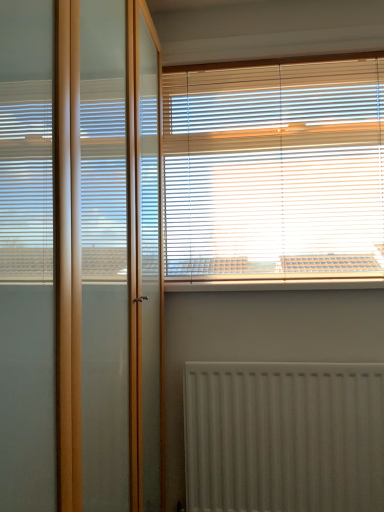
Locate an element on the screen. wooden blinds at upper center is located at coordinates (274, 169).

The width and height of the screenshot is (384, 512). What are the coordinates of `wooden blinds at upper center` in the screenshot? It's located at (274, 169).

From a real-world perspective, which object rests below the other?

white plastic window sill at upper center is physically lower.

Is transparent glass screen door at left not within white plastic window sill at upper center?

Yes, transparent glass screen door at left is not within white plastic window sill at upper center.

Considering the relative sizes of transparent glass screen door at left and white plastic window sill at upper center in the image provided, is transparent glass screen door at left thinner than white plastic window sill at upper center?

No.

The height and width of the screenshot is (512, 384). What are the coordinates of `window sill behind the transparent glass screen door at left` in the screenshot? It's located at (275, 284).

Does wooden blinds at upper center have a greater height compared to white plastic window sill at upper center?

Correct, wooden blinds at upper center is much taller as white plastic window sill at upper center.

From a real-world perspective, who is located lower, wooden blinds at upper center or white plastic window sill at upper center?

From a 3D spatial view, white plastic window sill at upper center is below.

Between wooden blinds at upper center and white plastic window sill at upper center, which one has larger width?

Wider between the two is white plastic window sill at upper center.

From the image's perspective, which object appears higher, wooden blinds at upper center or white plastic window sill at upper center?

wooden blinds at upper center appears higher in the image.

Is transparent glass screen door at left next to wooden blinds at upper center and touching it?

transparent glass screen door at left is not next to wooden blinds at upper center, and they're not touching.

From a real-world perspective, between transparent glass screen door at left and wooden blinds at upper center, who is vertically higher?

From a 3D spatial view, wooden blinds at upper center is above.

From the image's perspective, which object appears higher, transparent glass screen door at left or wooden blinds at upper center?

wooden blinds at upper center is shown above in the image.

Between transparent glass screen door at left and wooden blinds at upper center, which one has larger width?

Wider between the two is transparent glass screen door at left.

Between transparent glass screen door at left and white textured radiator at lower center, which one has smaller size?

Smaller between the two is white textured radiator at lower center.

From a real-world perspective, is transparent glass screen door at left positioned above or below white textured radiator at lower center?

Clearly, from a real-world perspective, transparent glass screen door at left is above white textured radiator at lower center.

Which is more to the right, transparent glass screen door at left or white textured radiator at lower center?

Positioned to the right is white textured radiator at lower center.

Is transparent glass screen door at left thinner than white textured radiator at lower center?

No, transparent glass screen door at left is not thinner than white textured radiator at lower center.

Where is `window blind on the right of transparent glass screen door at left`? The image size is (384, 512). window blind on the right of transparent glass screen door at left is located at coordinates click(x=274, y=169).

Which object is further away from the camera, wooden blinds at upper center or transparent glass screen door at left?

wooden blinds at upper center is further away from the camera.

Is wooden blinds at upper center shorter than transparent glass screen door at left?

Yes.

Is wooden blinds at upper center spatially inside transparent glass screen door at left, or outside of it?

wooden blinds at upper center is not inside transparent glass screen door at left, it's outside.

From a real-world perspective, who is located lower, wooden blinds at upper center or white textured radiator at lower center?

In real-world perspective, white textured radiator at lower center is lower.

Is white textured radiator at lower center a part of wooden blinds at upper center?

No.

Is wooden blinds at upper center aimed at white textured radiator at lower center?

No, wooden blinds at upper center does not turn towards white textured radiator at lower center.

Is wooden blinds at upper center wider than white textured radiator at lower center?

No.

Is white textured radiator at lower center outside of wooden blinds at upper center?

Yes.

From a real-world perspective, is white textured radiator at lower center positioned above or below wooden blinds at upper center?

In terms of real-world spatial position, white textured radiator at lower center is below wooden blinds at upper center.

Can you see white textured radiator at lower center touching wooden blinds at upper center?

No, white textured radiator at lower center is not in contact with wooden blinds at upper center.

Based on the photo, does white textured radiator at lower center turn towards wooden blinds at upper center?

No.

What are the coordinates of `screen door located in front of the white plastic window sill at upper center` in the screenshot? It's located at (78, 256).

You are a GUI agent. You are given a task and a screenshot of the screen. Output one action in this format:
    pyautogui.click(x=<x>, y=<y>)
    Task: Click on the window blind lying on the right of white plastic window sill at upper center
    
    Given the screenshot: What is the action you would take?
    [274, 169]

Considering their positions, is white plastic window sill at upper center positioned closer to white textured radiator at lower center than wooden blinds at upper center?

The object closer to white textured radiator at lower center is white plastic window sill at upper center.

Looking at the image, which one is located further to white plastic window sill at upper center, white textured radiator at lower center or transparent glass screen door at left?

transparent glass screen door at left lies further to white plastic window sill at upper center than the other object.

Which object lies further to the anchor point white textured radiator at lower center, wooden blinds at upper center or white plastic window sill at upper center?

wooden blinds at upper center is further to white textured radiator at lower center.

Looking at the image, which one is located closer to white plastic window sill at upper center, wooden blinds at upper center or transparent glass screen door at left?

wooden blinds at upper center.

Estimate the real-world distances between objects in this image. Which object is closer to wooden blinds at upper center, white plastic window sill at upper center or white textured radiator at lower center?

white plastic window sill at upper center is closer to wooden blinds at upper center.

Which object lies nearer to the anchor point wooden blinds at upper center, white textured radiator at lower center or white plastic window sill at upper center?

white plastic window sill at upper center is positioned closer to the anchor wooden blinds at upper center.

Looking at the image, which one is located closer to wooden blinds at upper center, white textured radiator at lower center or transparent glass screen door at left?

white textured radiator at lower center.

Looking at the image, which one is located closer to white textured radiator at lower center, wooden blinds at upper center or transparent glass screen door at left?

Among the two, wooden blinds at upper center is located nearer to white textured radiator at lower center.

This screenshot has width=384, height=512. What are the coordinates of `window sill between transparent glass screen door at left and white textured radiator at lower center in the up-down direction` in the screenshot? It's located at (275, 284).

At what (x,y) coordinates should I click in order to perform the action: click on screen door between wooden blinds at upper center and white textured radiator at lower center vertically. Please return your answer as a coordinate pair (x, y). This screenshot has width=384, height=512. Looking at the image, I should click on (78, 256).

You are a GUI agent. You are given a task and a screenshot of the screen. Output one action in this format:
    pyautogui.click(x=<x>, y=<y>)
    Task: Click on the window sill located between transparent glass screen door at left and wooden blinds at upper center in the depth direction
    This screenshot has height=512, width=384.
    Given the screenshot: What is the action you would take?
    275,284

Identify the location of window sill between wooden blinds at upper center and white textured radiator at lower center from top to bottom. (275, 284).